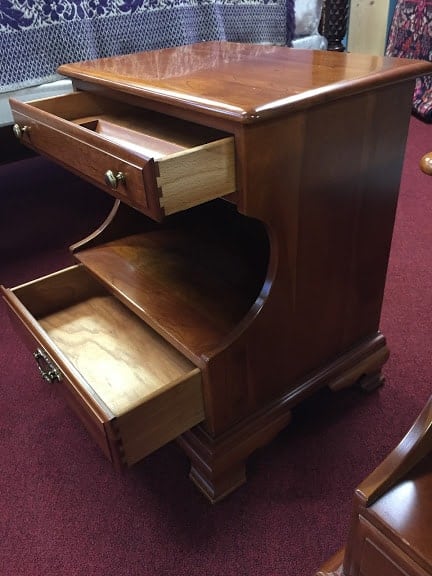
The height and width of the screenshot is (576, 432). I want to click on lower drawer, so click(80, 405).